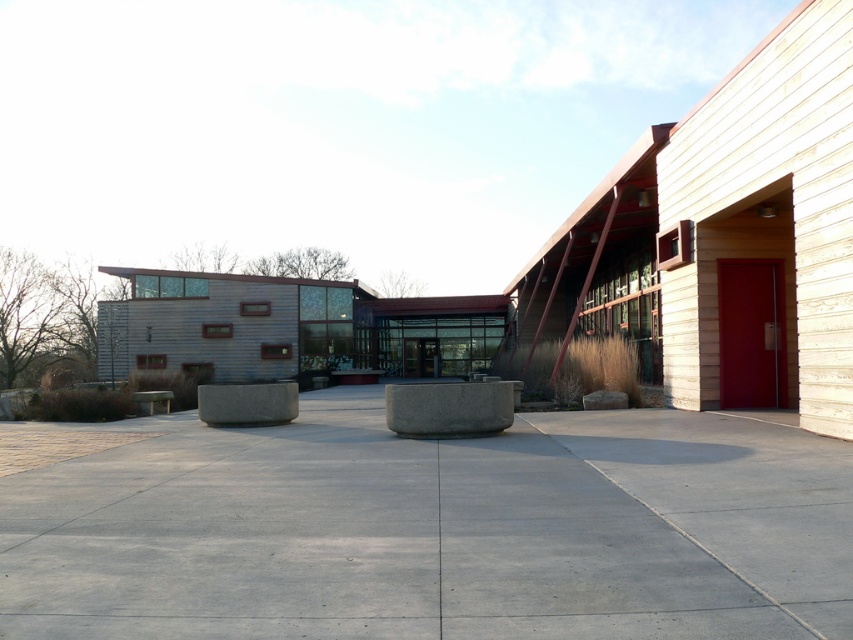
Who is more distant from viewer, (566, 538) or (254, 412)?

The point (254, 412) is behind.

The height and width of the screenshot is (640, 853). I want to click on gray concrete pavement at center, so click(425, 528).

Is gray concrete planter at center bigger than gray concrete at center?

Incorrect, gray concrete planter at center is not larger than gray concrete at center.

Between gray concrete planter at center and gray concrete at center, which one appears on the right side from the viewer's perspective?

gray concrete planter at center

Is point (389, 397) farther from viewer compared to point (267, 417)?

No, (389, 397) is in front of (267, 417).

Identify the location of gray concrete planter at center. This screenshot has height=640, width=853. (448, 408).

Is gray concrete pavement at center above gray concrete planter at center?

No, gray concrete pavement at center is not above gray concrete planter at center.

Consider the image. Between gray concrete pavement at center and gray concrete planter at center, which one is positioned lower?

gray concrete pavement at center is below.

Consider the image. Measure the distance between point (648, 470) and camera.

They are 26.09 feet apart.

The height and width of the screenshot is (640, 853). I want to click on gray concrete pavement at center, so click(x=425, y=528).